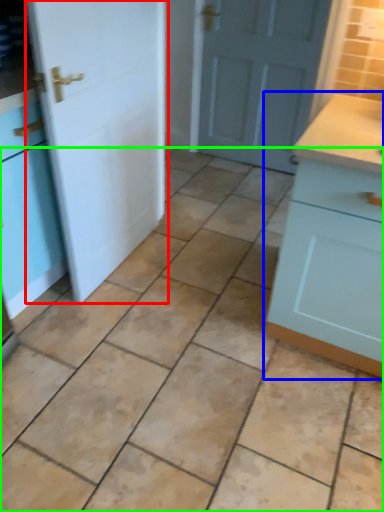
Question: Which object is the closest to the door (highlighted by a red box)? Choose among these: cabinetry (highlighted by a blue box) or ceramic tile (highlighted by a green box).

Choices:
 (A) cabinetry
 (B) ceramic tile

Answer: (B)